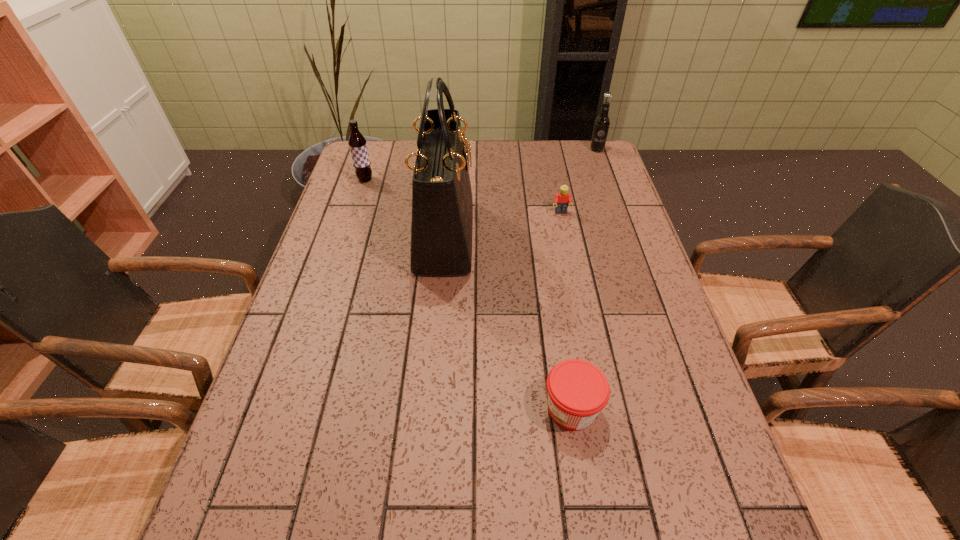
This screenshot has width=960, height=540. Identify the location of handbag. (442, 205).

This screenshot has height=540, width=960. I want to click on the fourth object from right to left, so click(x=442, y=205).

In order to click on the right root beer in this screenshot , I will do `click(601, 126)`.

I want to click on the farthest object, so (601, 126).

Where is `the leftmost object`? This screenshot has width=960, height=540. the leftmost object is located at coordinates (357, 143).

Where is `the second farthest object`? the second farthest object is located at coordinates (357, 143).

At what (x,y) coordinates should I click in order to perform the action: click on the nearest object. Please return your answer as a coordinate pair (x, y). Looking at the image, I should click on (577, 390).

The width and height of the screenshot is (960, 540). What are the coordinates of `Lego` in the screenshot? It's located at (561, 200).

This screenshot has height=540, width=960. Identify the location of free space located at the front of the tallest object with visible charms. [x=507, y=235].

At what (x,y) coordinates should I click in order to perform the action: click on blank area located on the label of the right root beer. Please return your answer as a coordinate pair (x, y). Looking at the image, I should click on (612, 190).